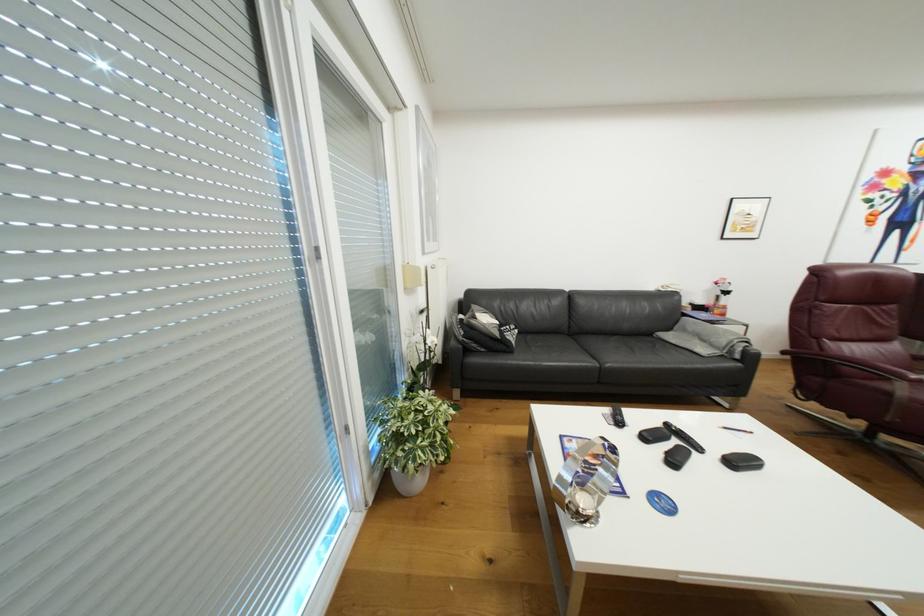
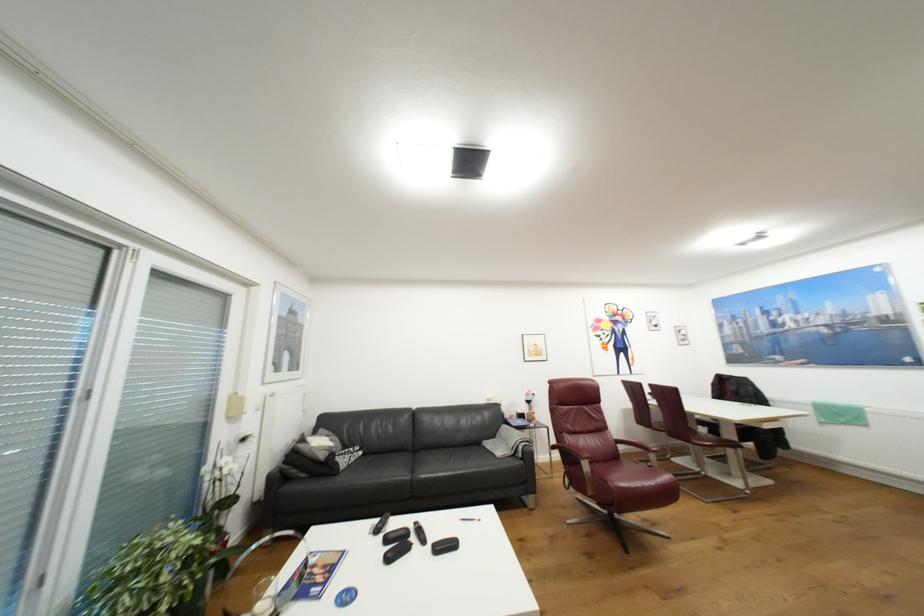
Locate, in the second image, the point that corresponds to the point at 521,337 in the first image.

(359, 459)